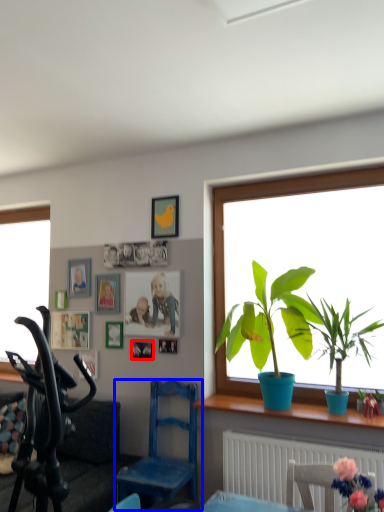
Question: Which object appears farthest to the camera in this image, picture frame (highlighted by a red box) or chair (highlighted by a blue box)?

Choices:
 (A) picture frame
 (B) chair

Answer: (A)